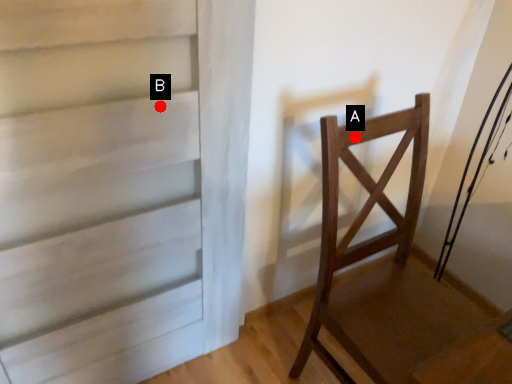
Question: Two points are circled on the image, labeled by A and B beside each circle. Which point appears farthest from the camera in this image?

Choices:
 (A) A is further
 (B) B is further

Answer: (A)